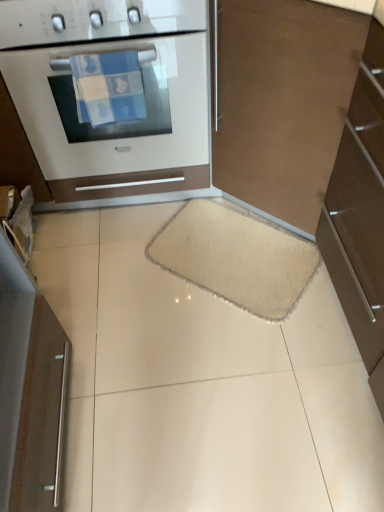
Question: In the image, is beige fuzzy mat at center on the left side or the right side of metallic silver fridge at left?

Choices:
 (A) right
 (B) left

Answer: (A)

Question: Is beige fuzzy mat at center taller or shorter than metallic silver fridge at left?

Choices:
 (A) tall
 (B) short

Answer: (B)

Question: Which object is the closest to the brown matte cabinet at right?

Choices:
 (A) beige fuzzy mat at center
 (B) white glossy oven at upper left
 (C) metallic silver fridge at left

Answer: (A)

Question: Considering the real-world distances, which object is farthest from the brown matte cabinet at right?

Choices:
 (A) beige fuzzy mat at center
 (B) metallic silver fridge at left
 (C) white glossy oven at upper left

Answer: (B)